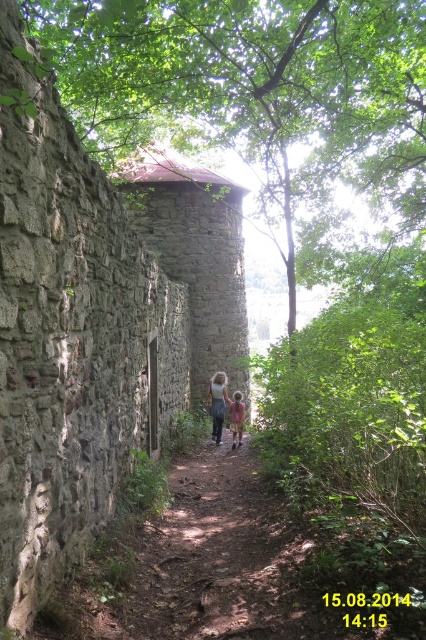
Question: Does denim skirt at center appear on the right side of light pink cotton shirt at center?

Choices:
 (A) yes
 (B) no

Answer: (B)

Question: Which point is closer to the camera taking this photo?

Choices:
 (A) (236, 419)
 (B) (219, 442)

Answer: (A)

Question: Can you confirm if denim skirt at center is positioned above light pink cotton shirt at center?

Choices:
 (A) no
 (B) yes

Answer: (B)

Question: Is denim skirt at center to the right of light pink cotton shirt at center from the viewer's perspective?

Choices:
 (A) no
 (B) yes

Answer: (A)

Question: Which of the following is the farthest from the observer?

Choices:
 (A) denim skirt at center
 (B) light pink cotton shirt at center

Answer: (A)